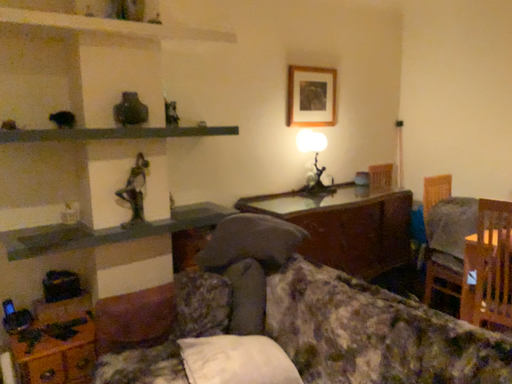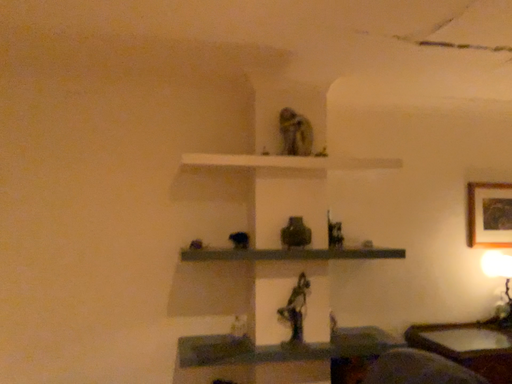
Question: How did the camera likely rotate when shooting the video?

Choices:
 (A) rotated right
 (B) rotated left

Answer: (B)